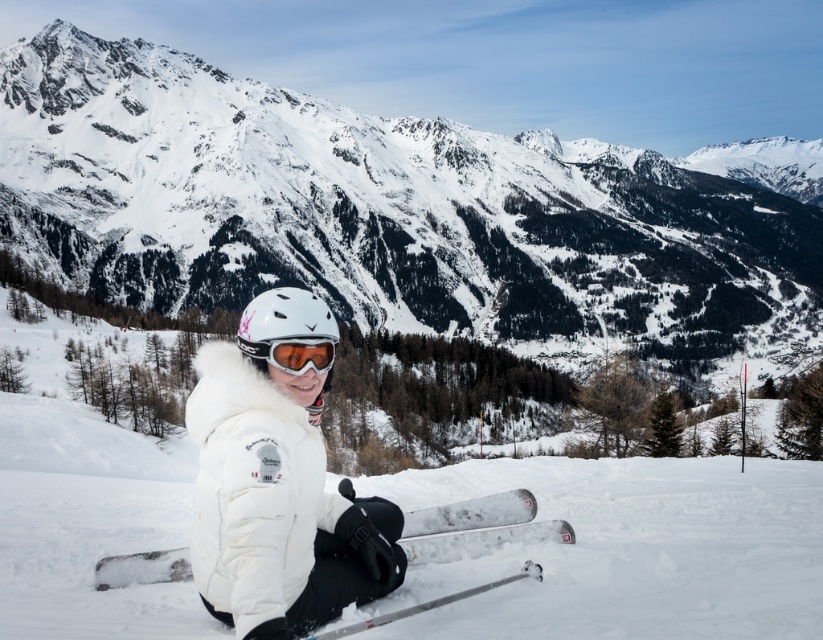
You are a photographer planning to take a photo of the snowy mountain at center and the silver metallic ski at lower center. Based on their positions in the image, which object should you focus on first to ensure both are in sharp focus?

The snowy mountain at center is above the silver metallic ski at lower center. Since the ski is closer to the camera, focusing on it first will help ensure both objects are in focus due to the depth of field.